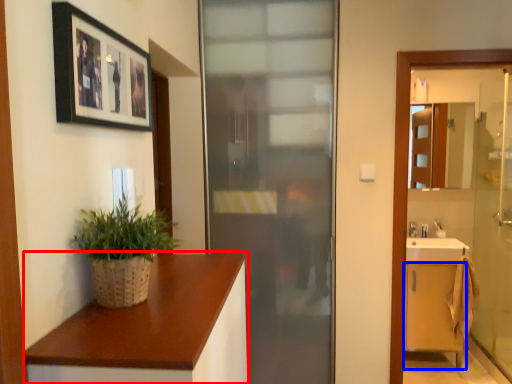
Question: Which of the following is the closest to the observer, countertop (highlighted by a red box) or cabinetry (highlighted by a blue box)?

Choices:
 (A) countertop
 (B) cabinetry

Answer: (A)